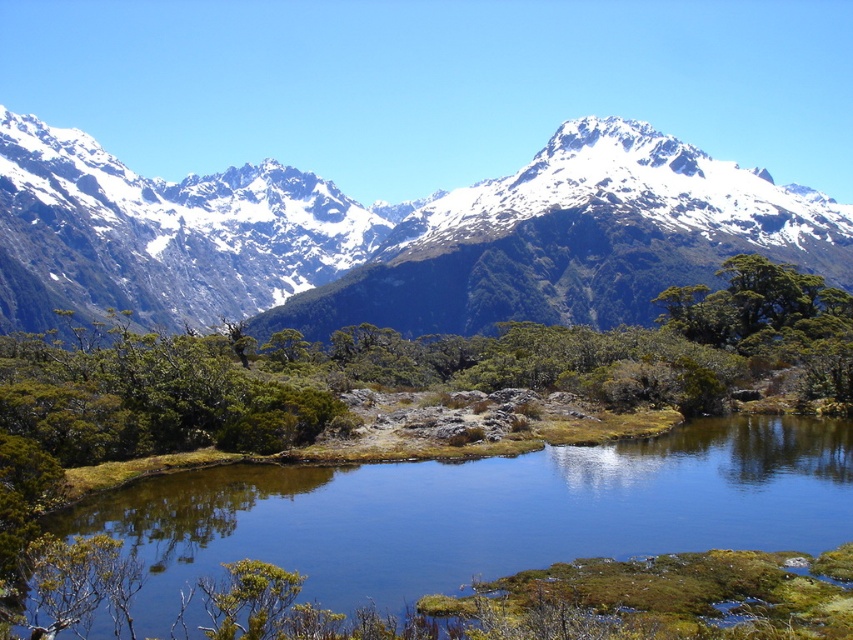
Question: From the image, what is the correct spatial relationship of white snow-covered mountain range at upper center in relation to green mossy water at center?

Choices:
 (A) right
 (B) left

Answer: (B)

Question: Does white snow-covered mountain range at upper center have a larger size compared to green mossy water at center?

Choices:
 (A) no
 (B) yes

Answer: (B)

Question: Can you confirm if white snow-covered mountain range at upper center is thinner than green mossy water at center?

Choices:
 (A) no
 (B) yes

Answer: (A)

Question: Which point is closer to the camera?

Choices:
 (A) white snow-covered mountain range at upper center
 (B) green mossy water at center

Answer: (B)

Question: Which of the following is the closest to the observer?

Choices:
 (A) (183, 541)
 (B) (666, 234)

Answer: (A)